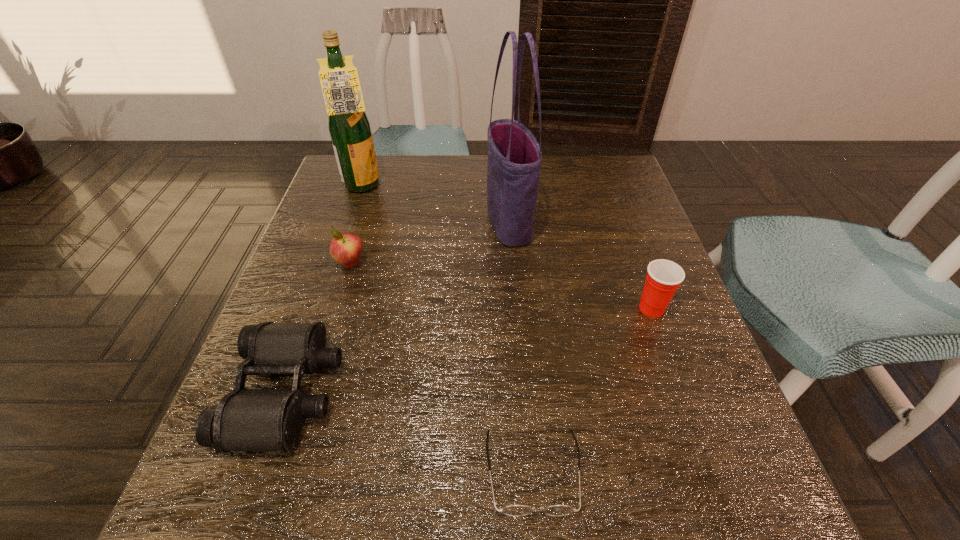
You are a GUI agent. You are given a task and a screenshot of the screen. Output one action in this format:
    pyautogui.click(x=<x>, y=<y>)
    Task: Click on the free spot at the far edge of the desktop
    The image size is (960, 540).
    Given the screenshot: What is the action you would take?
    pyautogui.click(x=395, y=194)

The image size is (960, 540). What are the coordinates of `free space at the near edge of the desktop` in the screenshot? It's located at (378, 503).

At what (x,y) coordinates should I click in order to perform the action: click on vacant space at the left edge of the desktop. Please return your answer as a coordinate pair (x, y). The height and width of the screenshot is (540, 960). Looking at the image, I should click on (320, 226).

The width and height of the screenshot is (960, 540). What are the coordinates of `free spot at the right edge of the desktop` in the screenshot? It's located at (690, 370).

Locate an element on the screen. The height and width of the screenshot is (540, 960). free region at the far left corner is located at coordinates (394, 158).

Image resolution: width=960 pixels, height=540 pixels. Identify the location of free spot at the far right corner of the desktop. [581, 202].

Where is `vacant space that is in between the apple and the rightmost object`? vacant space that is in between the apple and the rightmost object is located at coordinates (501, 286).

The height and width of the screenshot is (540, 960). Find the location of `free point between the apple and the Dixie cup`. free point between the apple and the Dixie cup is located at coordinates (501, 286).

Locate an element on the screen. This screenshot has height=540, width=960. empty space between the liquor and the spectacles is located at coordinates (447, 329).

The height and width of the screenshot is (540, 960). Identify the location of vacant space in between the liquor and the third farthest object. (356, 225).